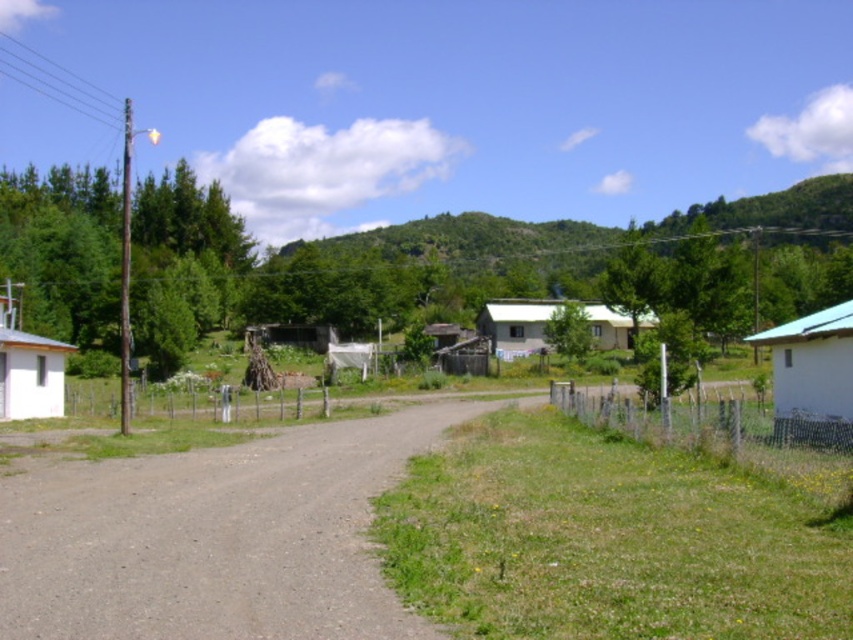
From the picture: You are a delivery drone flying above the rural area. You need to land on the gray gravel road at center without hitting the white matte hut at right. Can you safely land there?

The gray gravel road at center is positioned under the white matte hut at right, so landing there may be unsafe as the hut could obstruct the landing path.

You are standing at the point with coordinates point (171, 586) and want to walk to point (33, 413). Based on the scene description, which direction should you move relative to your current position?

Since point (171, 586) is closer to the camera than point (33, 413), you should move forward to reach the farther point.

You are a delivery driver trying to navigate through the gray gravel road at center and the white matte hut at left. Which one has a larger footprint in terms of size?

The white matte hut at left has a larger footprint than the gray gravel road at center, as the gray gravel road at center is described as having a smaller size compared to the white matte hut at left.